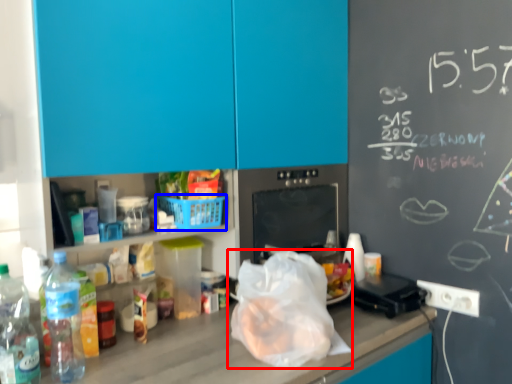
Question: Which object is closer to the camera taking this photo, plastic bag (highlighted by a red box) or basket (highlighted by a blue box)?

Choices:
 (A) plastic bag
 (B) basket

Answer: (A)